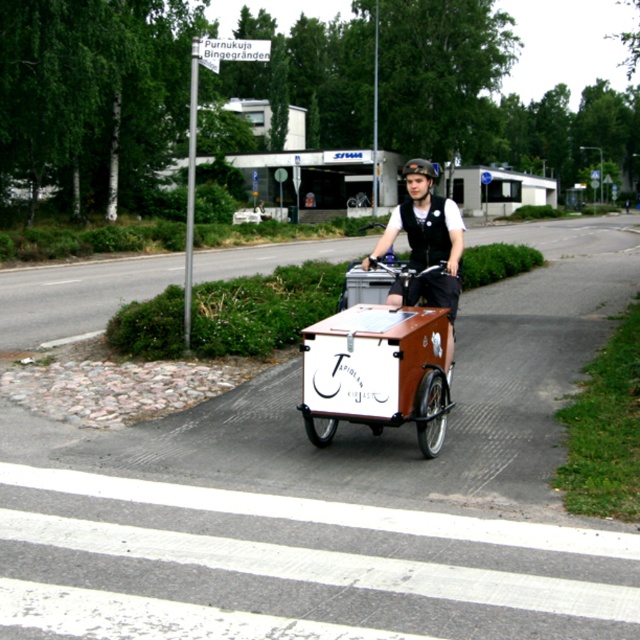
You are a pedestrian trying to cross the road where the brown matte cargo bike at center and the matte black vest at center are located. Considering their sizes, which object would require more space to maneuver around?

The brown matte cargo bike at center requires more space to maneuver around since its width is larger than the matte black vest at center.

You are a delivery person who needs to secure a package on the brown matte cargo bike at center. Your vest, the matte black vest at center, has a pocket that can hold a tool needed for this task. Can you reach the tool in your vest pocket while holding onto the handlebars of the cargo bike?

The brown matte cargo bike at center and the matte black vest at center are 33.56 inches apart. Since the distance between them is about 33.56 inches, which is roughly the length of an average adult arm, the delivery person can likely reach the tool in the matte black vest at center pocket while holding the handlebars of the brown matte cargo bike at center.

You are a pedestrian standing at the edge of the road. You see the brown matte cargo bike at center and the matte black vest at center. Which object is closer to you?

The brown matte cargo bike at center is closer to the viewer than the matte black vest at center.